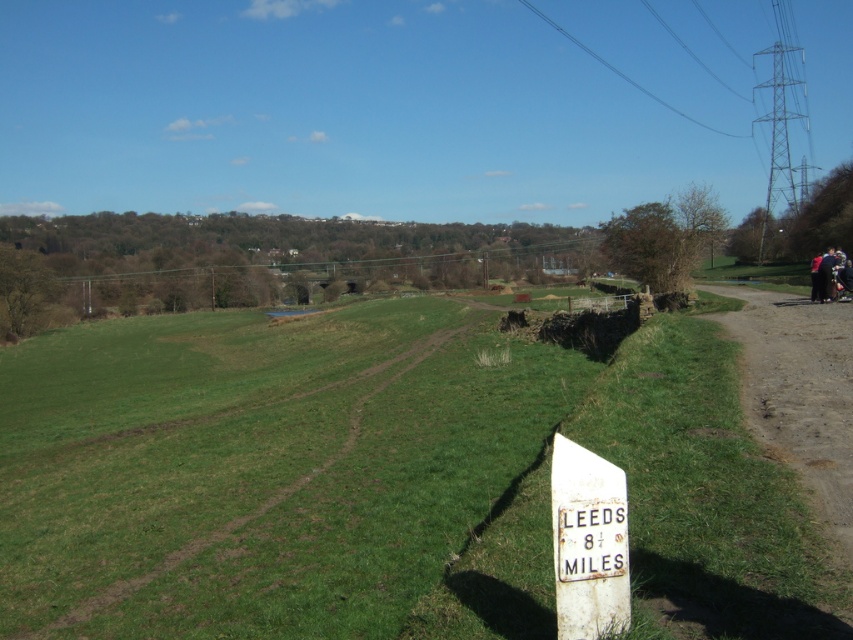
You are standing at the center of the dirt path in the rural landscape. You want to walk to the green grassy at lower left. Which direction should you head towards?

The green grassy at lower left is located at point (381, 480), so you should head towards the lower left direction to reach it.

You are a hiker standing at the start of the dirt path. You see the green grassy at lower left and the brown wooden power line at upper center. Which object is closer to you?

The green grassy at lower left is closer to you because it is in front of the brown wooden power line at upper center.